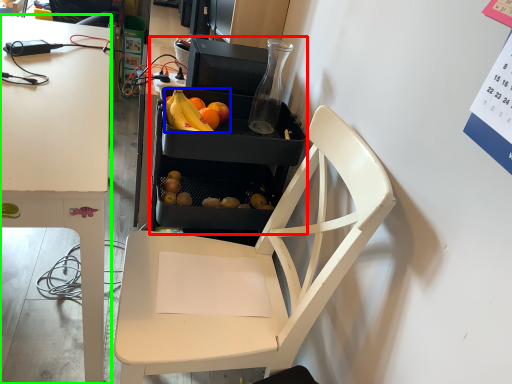
Question: Based on their relative distances, which object is nearer to appliance (highlighted by a red box)? Choose from grapefruit (highlighted by a blue box) and desk (highlighted by a green box).

Choices:
 (A) grapefruit
 (B) desk

Answer: (A)